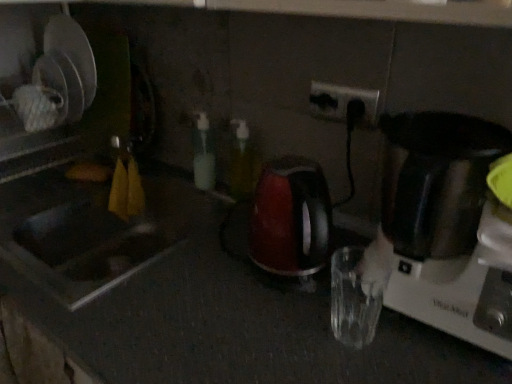
Question: Looking at their shapes, would you say white plastic electric outlet at upper center is wider or thinner than green translucent bottle at center, positioned as the 2th bottle in left-to-right order?

Choices:
 (A) thin
 (B) wide

Answer: (A)

Question: From a real-world perspective, is white plastic electric outlet at upper center above or below green translucent bottle at center, positioned as the 2th bottle in left-to-right order?

Choices:
 (A) below
 (B) above

Answer: (B)

Question: Which object is positioned farthest from the shiny black blender at right?

Choices:
 (A) translucent plastic bottle at center, which is counted as the 2th bottle, starting from the right
 (B) white plastic electric outlet at upper center
 (C) matte stainless steel sink at left
 (D) green translucent bottle at center, positioned as the 2th bottle in left-to-right order

Answer: (C)

Question: Which object is the farthest from the shiny black blender at right?

Choices:
 (A) matte stainless steel sink at left
 (B) white plastic electric outlet at upper center
 (C) green translucent bottle at center, positioned as the 2th bottle in left-to-right order
 (D) translucent plastic bottle at center, acting as the 1th bottle starting from the left

Answer: (A)